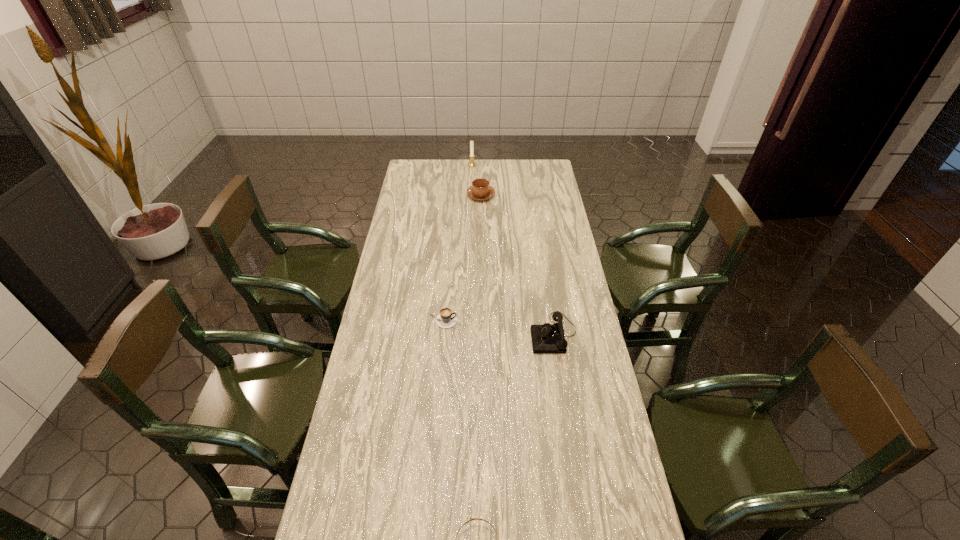
This screenshot has height=540, width=960. In order to click on object that is the fourth closest one to the rightmost object in this screenshot , I will do `click(471, 164)`.